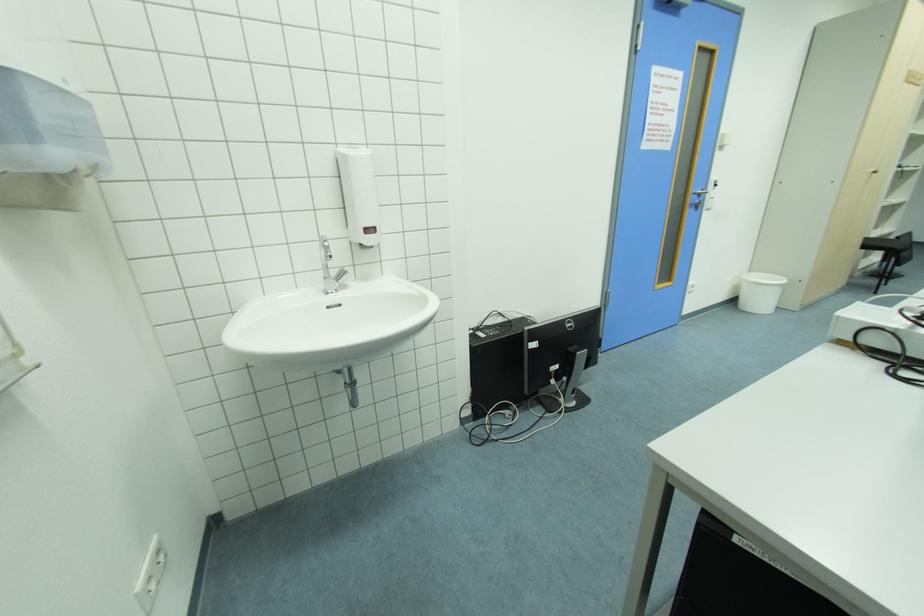
Locate an element on the screen. silver faucet handle is located at coordinates (334, 281).